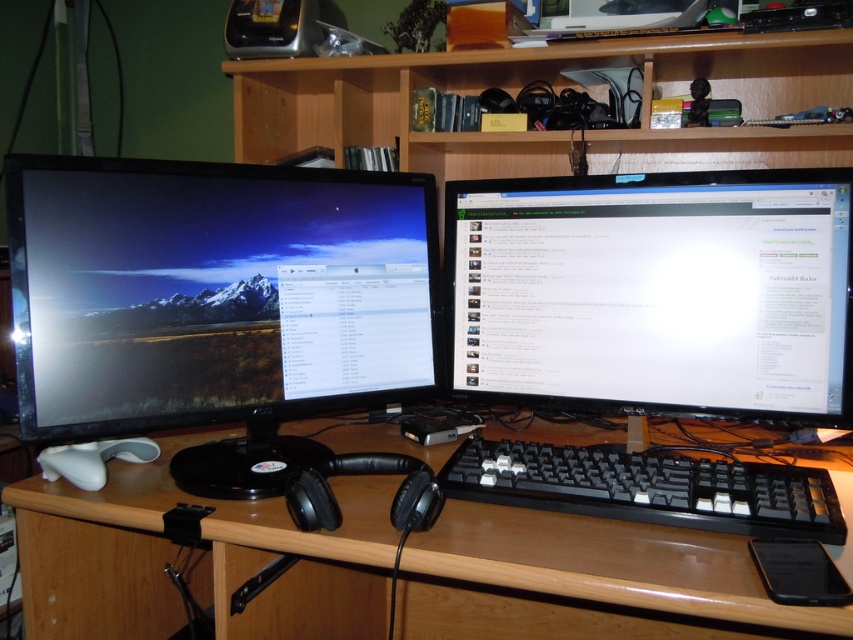
Is point (248, 273) less distant than point (552, 449)?

Yes, point (248, 273) is closer to viewer.

Does matte black monitor at left appear on the left side of black plastic keyboard at center?

Correct, you'll find matte black monitor at left to the left of black plastic keyboard at center.

Where is `matte black monitor at left`? This screenshot has height=640, width=853. matte black monitor at left is located at coordinates (218, 301).

Can you confirm if wooden at center is taller than black plastic keyboard at center?

Yes, wooden at center is taller than black plastic keyboard at center.

Is wooden at center above black plastic keyboard at center?

No.

You are a GUI agent. You are given a task and a screenshot of the screen. Output one action in this format:
    pyautogui.click(x=<x>, y=<y>)
    Task: Click on the wooden at center
    Image resolution: width=853 pixels, height=640 pixels.
    Given the screenshot: What is the action you would take?
    pyautogui.click(x=199, y=557)

The height and width of the screenshot is (640, 853). Describe the element at coordinates (654, 292) in the screenshot. I see `black matte monitor at center` at that location.

Does black matte monitor at center appear on the right side of matte black monitor at left?

Indeed, black matte monitor at center is positioned on the right side of matte black monitor at left.

Does point (497, 456) come behind point (288, 467)?

Yes, it is behind point (288, 467).

The height and width of the screenshot is (640, 853). Find the location of `black matte monitor at center`. black matte monitor at center is located at coordinates click(654, 292).